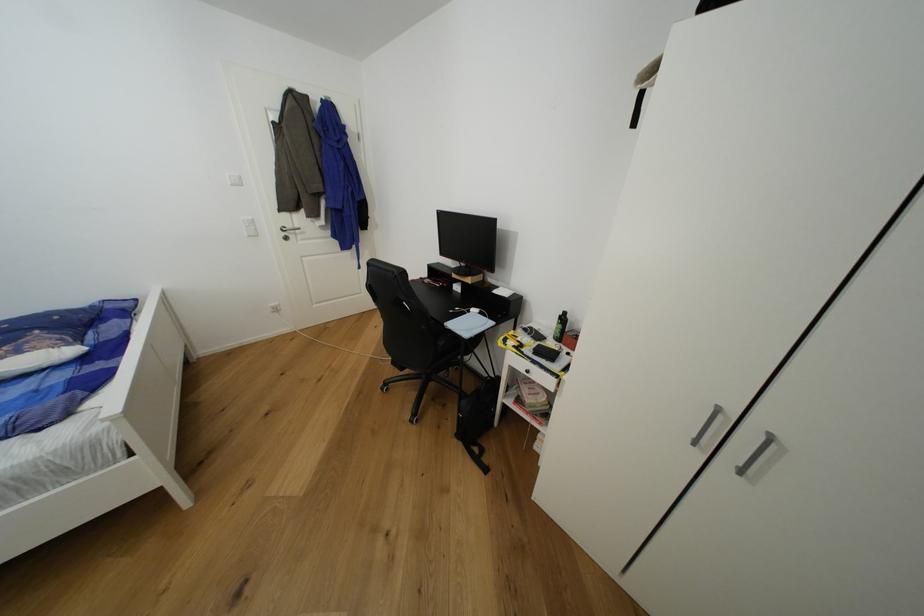
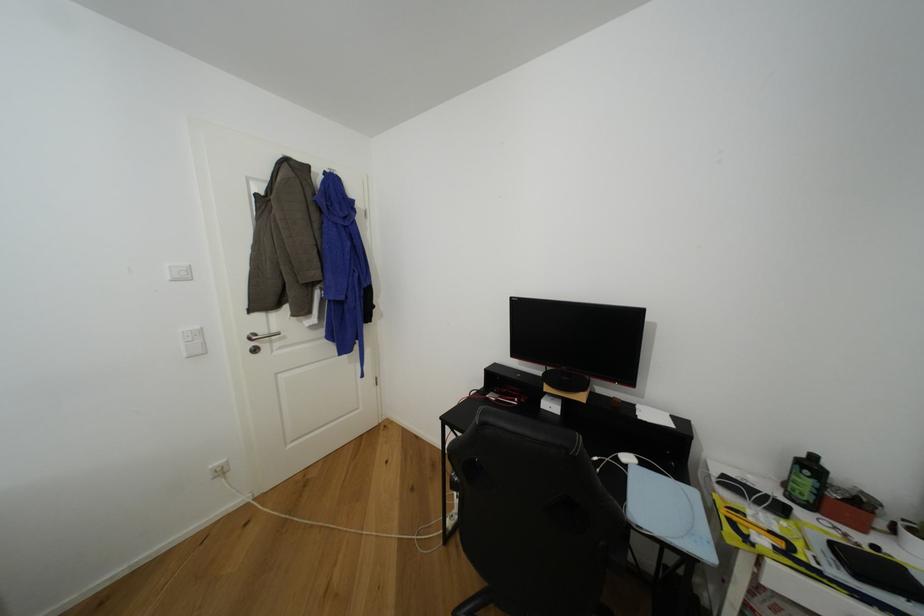
Find the pixel in the second image that matches point 463,289 in the first image.

(555, 408)